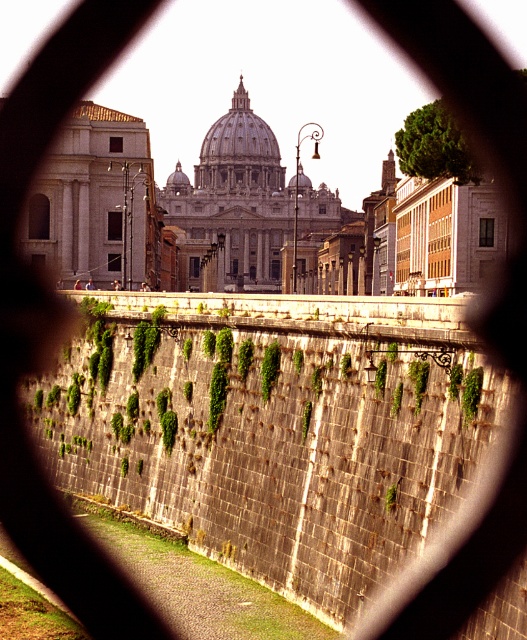
Between green mossy stone wall at center and white marble dome at center, which one is positioned lower?

green mossy stone wall at center

Does green mossy stone wall at center appear on the left side of white marble dome at center?

Incorrect, green mossy stone wall at center is not on the left side of white marble dome at center.

Which is behind, point (278, 570) or point (209, 273)?

Positioned behind is point (209, 273).

This screenshot has height=640, width=527. Identify the location of green mossy stone wall at center. pyautogui.click(x=277, y=428).

Can you confirm if white marble dome at center is positioned to the right of marble dome at center?

Correct, you'll find white marble dome at center to the right of marble dome at center.

From the picture: Between white marble dome at center and marble dome at center, which one has less height?

With less height is marble dome at center.

Does point (268, 243) come closer to viewer compared to point (250, 157)?

Yes, point (268, 243) is in front of point (250, 157).

You are a GUI agent. You are given a task and a screenshot of the screen. Output one action in this format:
    pyautogui.click(x=<x>, y=<y>)
    Task: Click on the white marble dome at center
    
    Given the screenshot: What is the action you would take?
    pyautogui.click(x=241, y=205)

How much distance is there between green mossy stone wall at center and marble dome at center?

green mossy stone wall at center is 837.91 feet from marble dome at center.

Is green mossy stone wall at center smaller than marble dome at center?

Correct, green mossy stone wall at center occupies less space than marble dome at center.

Image resolution: width=527 pixels, height=640 pixels. What are the coordinates of `green mossy stone wall at center` in the screenshot? It's located at (277, 428).